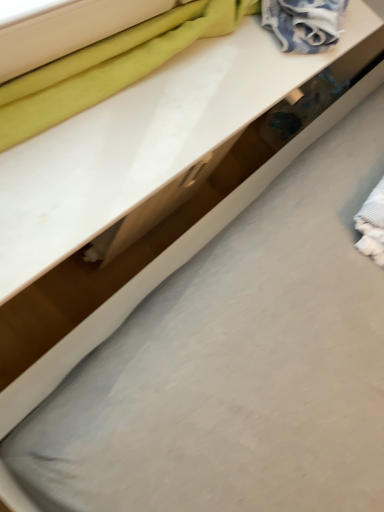
At what (x,y) coordinates should I click in order to perform the action: click on free area below matte yellow fabric at upper left (from a real-world perspective). Please return your answer as a coordinate pair (x, y). The image size is (384, 512). Looking at the image, I should click on (147, 68).